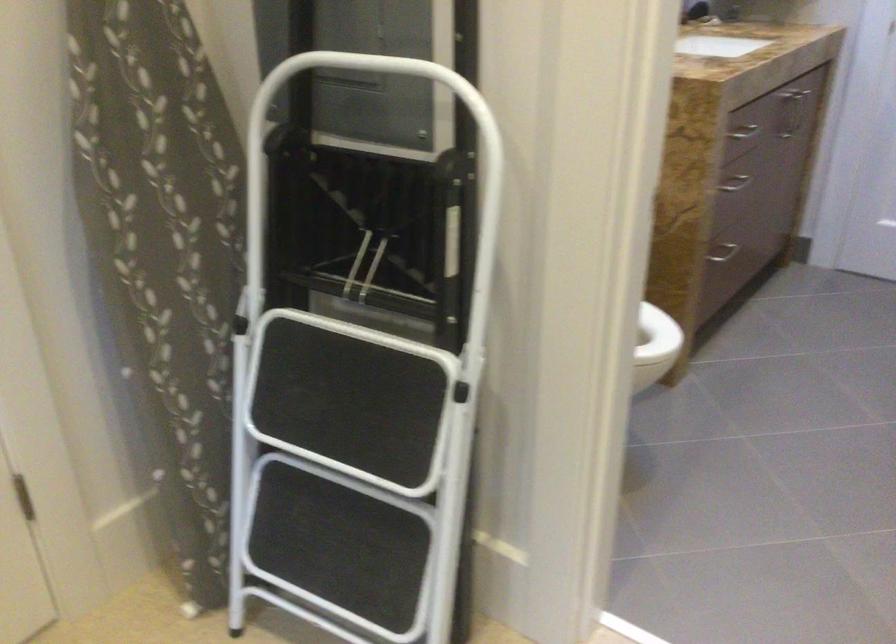
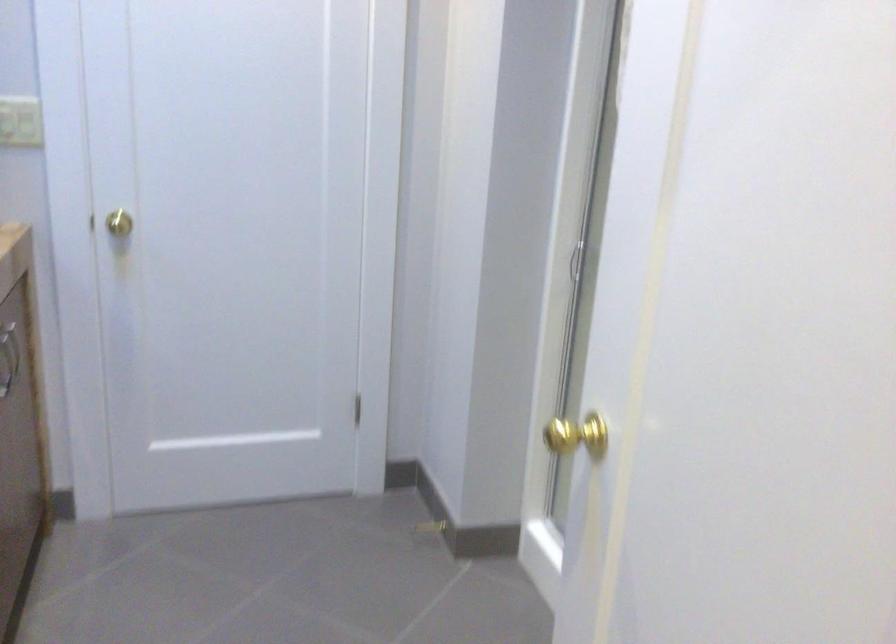
Question: How did the camera likely rotate?

Choices:
 (A) Left
 (B) Right
 (C) Up
 (D) Down

Answer: (B)